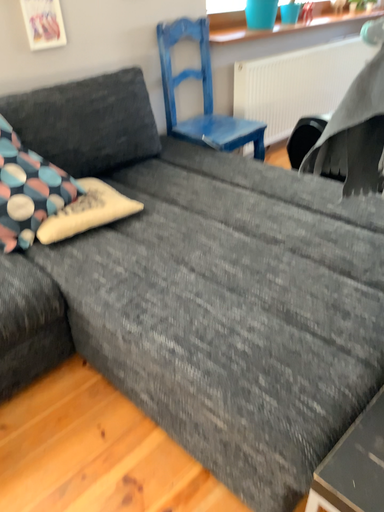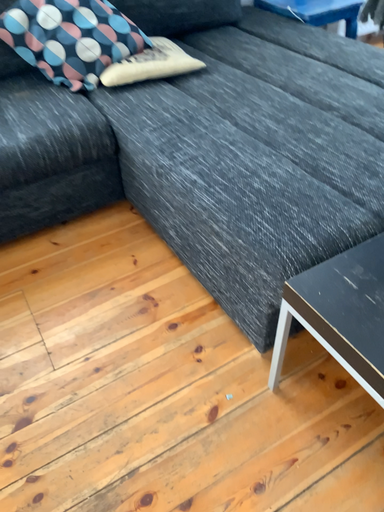
Question: Which way did the camera rotate in the video?

Choices:
 (A) rotated right
 (B) rotated left

Answer: (B)